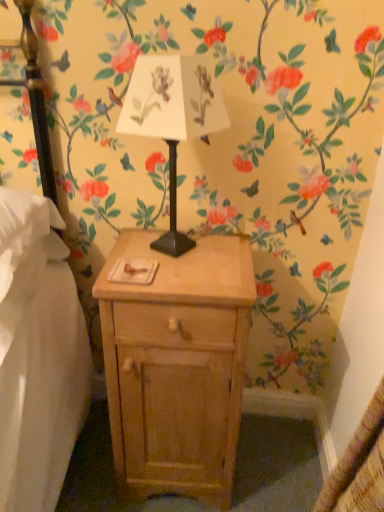
Identify the location of free space to the right of white paper lampshade at center. [230, 257].